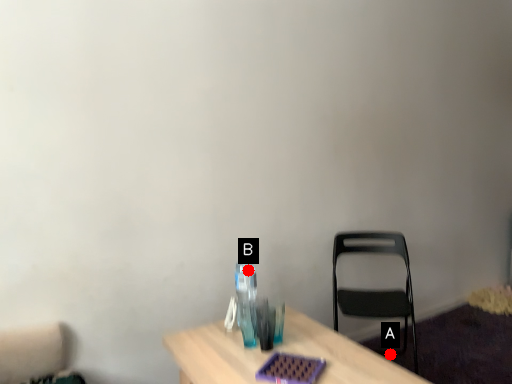
Question: Two points are circled on the image, labeled by A and B beside each circle. Which point appears farthest from the camera in this image?

Choices:
 (A) A is further
 (B) B is further

Answer: (A)